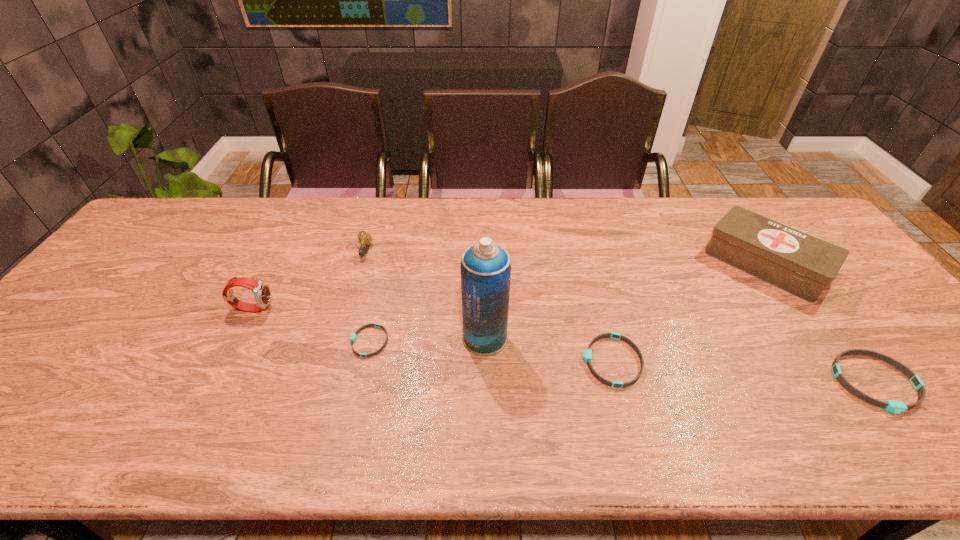
Locate an element on the screen. the tallest object is located at coordinates coord(485,267).

Identify the location of free space located 0.390m on the buckle of the shortest object. (193, 341).

Identify the location of vacant area situated on the buckle of the shortest object. The width and height of the screenshot is (960, 540). (205, 341).

Where is `free location located 0.180m on the buckle of the shortest object`? The image size is (960, 540). free location located 0.180m on the buckle of the shortest object is located at coordinates (277, 341).

Locate an element on the screen. vacant space situated on the buckle of the fifth object from left to right is located at coordinates (436, 361).

Where is `vacant area situated 0.070m on the buckle of the fifth object from left to right`? The height and width of the screenshot is (540, 960). vacant area situated 0.070m on the buckle of the fifth object from left to right is located at coordinates (553, 361).

What are the coordinates of `vacant space situated 0.170m on the buckle of the fifth object from left to right` in the screenshot? It's located at (512, 361).

Find the location of `vacant region located 0.190m on the front-facing side of the fourth shortest object`. vacant region located 0.190m on the front-facing side of the fourth shortest object is located at coordinates (348, 310).

The image size is (960, 540). I want to click on free point located 0.140m on the left of the first-aid kit, so 662,264.

Where is `free point located 0.330m on the face of the leftmost object`? free point located 0.330m on the face of the leftmost object is located at coordinates (396, 308).